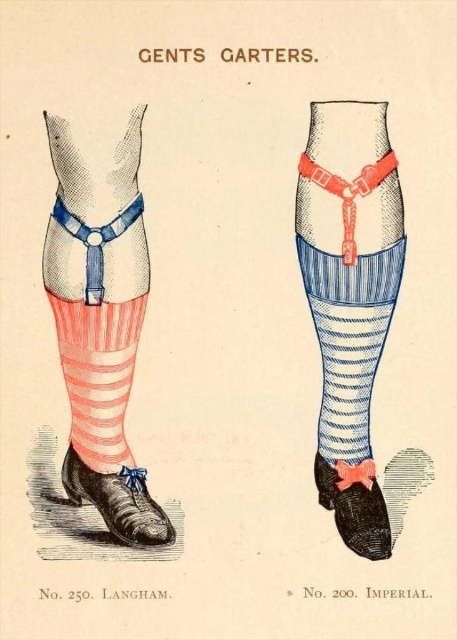
Question: Among these points, which one is nearest to the camera?

Choices:
 (A) (144, 296)
 (B) (346, 509)
 (C) (141, 512)

Answer: (C)

Question: Is matte blue garter at left smaller than black suede shoe at lower right?

Choices:
 (A) yes
 (B) no

Answer: (B)

Question: Is matte blue garter at left smaller than black suede shoe at lower right?

Choices:
 (A) no
 (B) yes

Answer: (A)

Question: Which of the following is the closest to the observer?

Choices:
 (A) (110, 396)
 (B) (148, 504)
 (C) (95, 397)
 (D) (366, 544)

Answer: (D)

Question: Is striped cotton sock at lower left below black suede shoe at lower right?

Choices:
 (A) yes
 (B) no

Answer: (B)

Question: Which is farther from the striped cotton sock at lower left?

Choices:
 (A) black suede shoe at lower right
 (B) matte blue garter at left

Answer: (A)